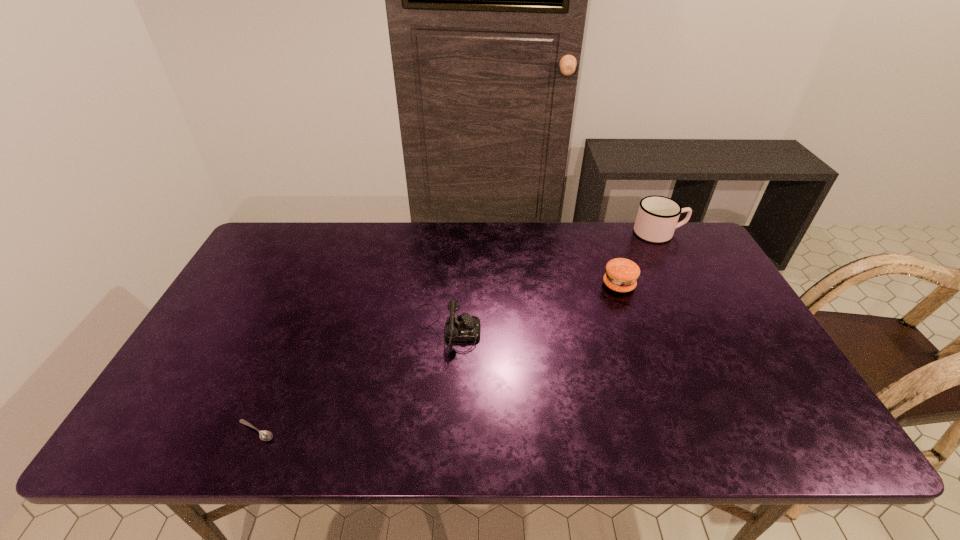
This screenshot has width=960, height=540. I want to click on unoccupied area between the patty and the third farthest object, so coord(533,307).

Locate an element on the screen. This screenshot has width=960, height=540. unoccupied area between the farthest object and the telephone is located at coordinates (553, 281).

The width and height of the screenshot is (960, 540). I want to click on free space between the third object from right to left and the third object from left to right, so click(x=533, y=307).

This screenshot has width=960, height=540. Identify the location of empty location between the telephone and the shortest object. (351, 380).

I want to click on free space between the telephone and the nearest object, so click(x=351, y=380).

At what (x,y) coordinates should I click in order to perform the action: click on free space between the shortest object and the third object from right to left. Please return your answer as a coordinate pair (x, y). The height and width of the screenshot is (540, 960). Looking at the image, I should click on (351, 380).

Where is `vacant point located between the mug and the telephone`? This screenshot has height=540, width=960. vacant point located between the mug and the telephone is located at coordinates (553, 281).

In order to click on object that can be found as the second closest to the farthest object in this screenshot , I will do coord(464,327).

Locate an element on the screen. the third closest object relative to the tallest object is located at coordinates (264, 435).

I want to click on vacant space that satisfies the following two spatial constraints: 1. on the front side of the patty; 2. on the front-facing side of the third object from right to left, so click(x=635, y=329).